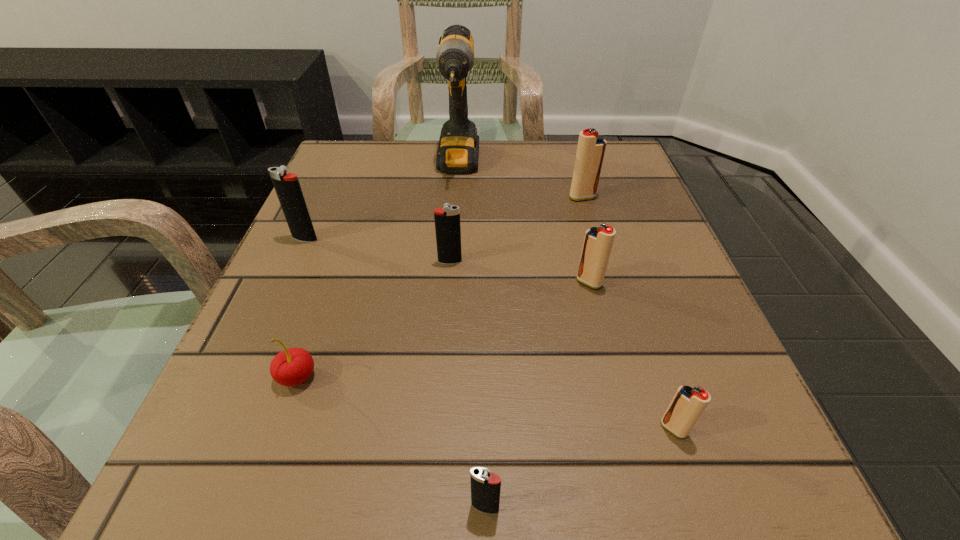
Identify the location of free location at the near edge. This screenshot has width=960, height=540. (338, 490).

In order to click on vacant space at the left edge of the desktop in this screenshot , I will do `click(252, 416)`.

Where is `vacant space at the right edge of the desktop`? vacant space at the right edge of the desktop is located at coordinates (652, 281).

The height and width of the screenshot is (540, 960). Identify the location of free space at the far left corner of the desktop. (360, 184).

The height and width of the screenshot is (540, 960). What are the coordinates of `free region at the near left corner of the desktop` in the screenshot? It's located at (276, 444).

Identify the location of vacant space at the far right corner. The image size is (960, 540). (625, 167).

Locate an element on the screen. blank region between the leftmost igniter and the nearest black igniter is located at coordinates (395, 373).

Find the location of a particular element. The image size is (960, 540). vacant point located between the drill and the red cherry is located at coordinates (378, 271).

The width and height of the screenshot is (960, 540). In order to click on free space between the second farthest igniter and the red cherry in this screenshot , I will do `click(301, 307)`.

Identify the location of vacant space that's between the sixth farthest object and the leftmost object. (301, 307).